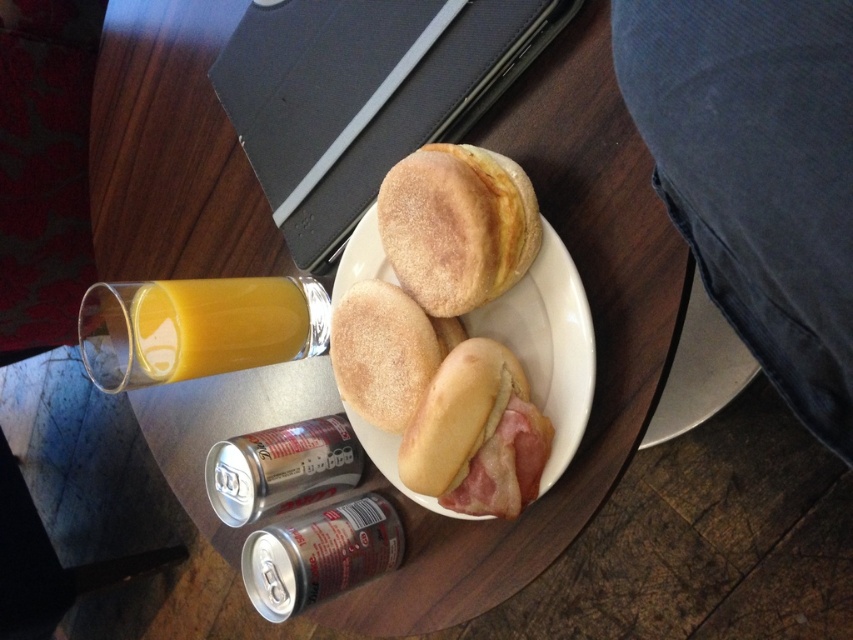
Question: Estimate the real-world distances between objects in this image. Which object is closer to the golden brown bread at center?

Choices:
 (A) silver metallic can at lower center
 (B) white ceramic plate at center
 (C) golden brown crusty bread at center
 (D) golden brown muffins at center

Answer: (D)

Question: Can you confirm if silver metallic can at lower center is positioned below golden brown matte english muffin at center?

Choices:
 (A) yes
 (B) no

Answer: (A)

Question: Where is golden brown muffins at center located in relation to golden brown crusty bread at center in the image?

Choices:
 (A) below
 (B) above

Answer: (A)

Question: Which is nearer to the translucent glass orange juice at left?

Choices:
 (A) golden brown matte english muffin at center
 (B) white ceramic plate at center
 (C) golden brown muffins at center
 (D) golden brown bread at center

Answer: (A)

Question: Can you confirm if white ceramic plate at center is bigger than golden brown matte english muffin at center?

Choices:
 (A) yes
 (B) no

Answer: (A)

Question: Which object is positioned farthest from the translucent glass orange juice at left?

Choices:
 (A) white ceramic plate at center
 (B) golden brown matte english muffin at center
 (C) golden brown muffins at center

Answer: (C)